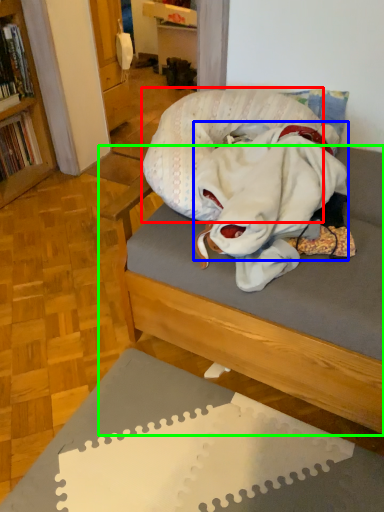
Question: Which object is the closest to the pillow (highlighted by a red box)? Choose among these: clothing (highlighted by a blue box) or studio couch (highlighted by a green box).

Choices:
 (A) clothing
 (B) studio couch

Answer: (A)